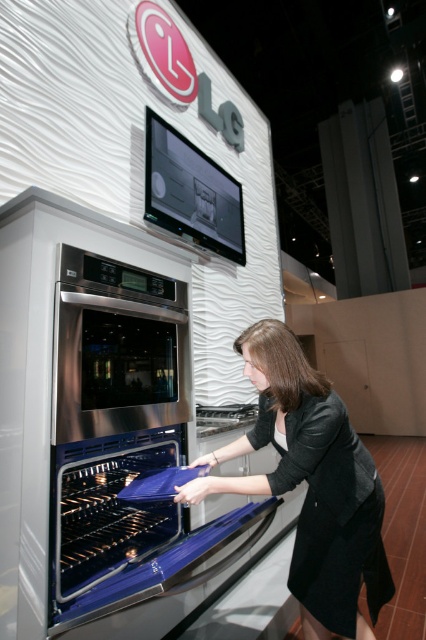
Question: Which point is closer to the camera?

Choices:
 (A) [x=143, y=342]
 (B) [x=333, y=509]

Answer: (B)

Question: Does stainless steel oven at center appear over black fabric dress at lower center?

Choices:
 (A) no
 (B) yes

Answer: (B)

Question: Is stainless steel oven at center below black fabric dress at lower center?

Choices:
 (A) no
 (B) yes

Answer: (A)

Question: Which of the following is the closest to the observer?

Choices:
 (A) stainless steel oven at center
 (B) black fabric dress at lower center

Answer: (A)

Question: Can you confirm if stainless steel oven at center is positioned to the right of black fabric dress at lower center?

Choices:
 (A) no
 (B) yes

Answer: (A)